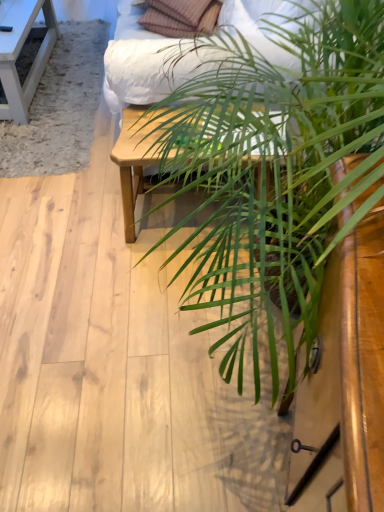
Question: Looking at their shapes, would you say matte white bed frame at upper center is wider or thinner than white wood table at upper left, the second table in the right-to-left sequence?

Choices:
 (A) thin
 (B) wide

Answer: (A)

Question: In the image, is matte white bed frame at upper center on the left side or the right side of white wood table at upper left, the second table in the right-to-left sequence?

Choices:
 (A) right
 (B) left

Answer: (A)

Question: Which object is the farthest from the plaid fabric pillow at upper center?

Choices:
 (A) green leafy plant at center
 (B) matte white bed frame at upper center
 (C) light wood table at center, the first table when ordered from right to left
 (D) white wood table at upper left, the 1th table in the top-to-bottom sequence

Answer: (A)

Question: Considering the real-world distances, which object is farthest from the light wood table at center, acting as the second table starting from the back?

Choices:
 (A) plaid fabric pillow at upper center
 (B) matte white bed frame at upper center
 (C) white wood table at upper left, which appears as the first table when viewed from the left
 (D) green leafy plant at center

Answer: (C)